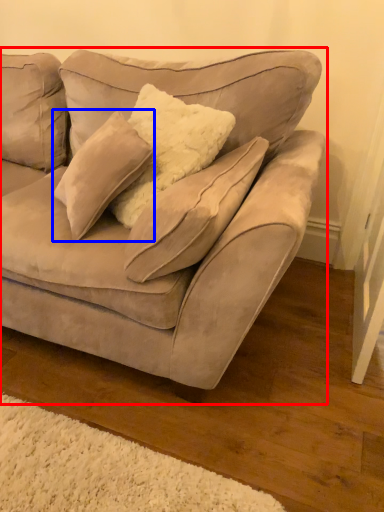
Question: Among these objects, which one is nearest to the camera, studio couch (highlighted by a red box) or pillow (highlighted by a blue box)?

Choices:
 (A) studio couch
 (B) pillow

Answer: (A)